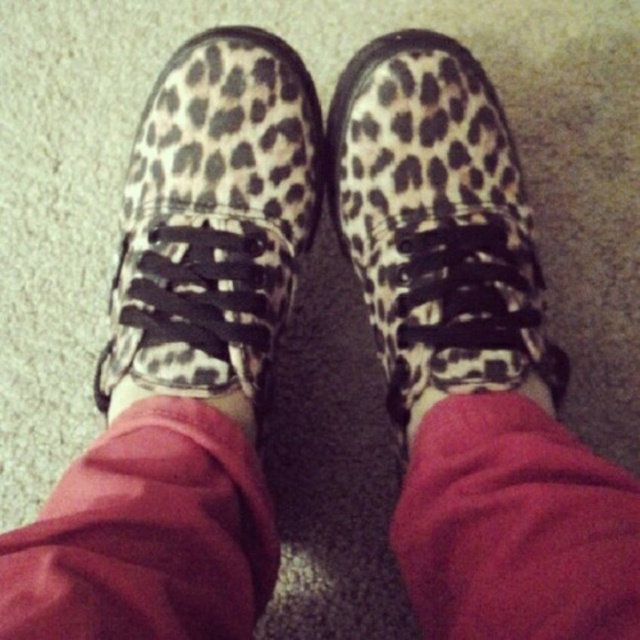
You are trying to decide which item to place in a small gift box that can only fit items up to the size of the pink fabric sock at center. Can the leopard print shoe at center fit in the box?

The leopard print shoe at center is larger in size than the pink fabric sock at center, so it cannot fit in the gift box designed for items up to the size of the pink fabric sock at center.

You are standing in a room with a beige carpeted floor. You see a leopard print shoe at center. Where exactly is the leopard print shoe located in terms of coordinates?

The leopard print shoe at center is located at coordinates point (436, 224).

You are standing in a room with a leopard print sneaker at center. If you take one step forward, will the sneaker at center appear larger to you?

The leopard print sneaker at center is 66.74 centimeters away from the viewer. If you move closer by taking a step forward, the sneaker will appear larger because objects closer to the viewer appear larger in size.